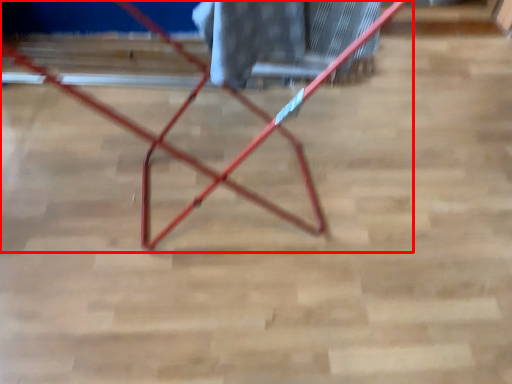
Question: From the image's perspective, what is the correct spatial positioning of furniture (annotated by the red box) in reference to laundry?

Choices:
 (A) below
 (B) above

Answer: (A)